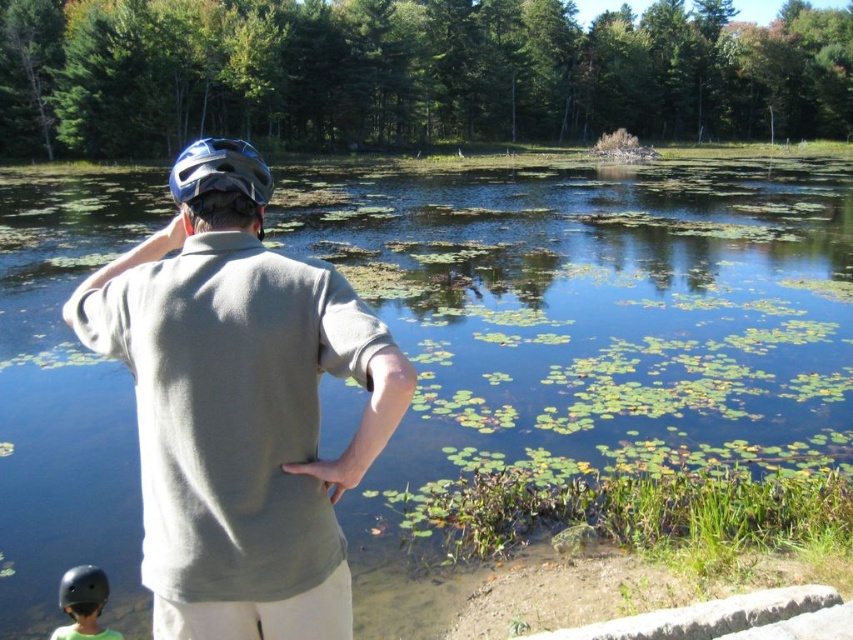
Question: Can you confirm if matte gray shirt at center is smaller than black matte helmet at lower left?

Choices:
 (A) no
 (B) yes

Answer: (B)

Question: Does matte gray shirt at center have a greater width compared to black matte helmet at lower left?

Choices:
 (A) yes
 (B) no

Answer: (B)

Question: Does matte gray shirt at center have a smaller size compared to black matte helmet at lower left?

Choices:
 (A) no
 (B) yes

Answer: (B)